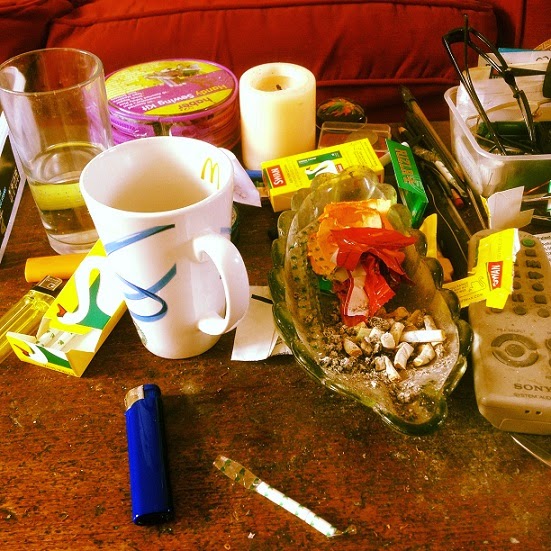
Image resolution: width=551 pixels, height=551 pixels. In order to click on candle wick in this screenshot , I will do coord(276,85).